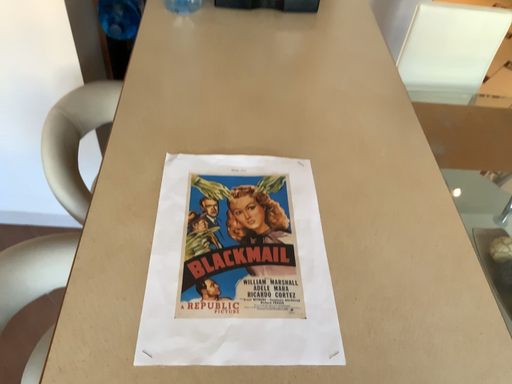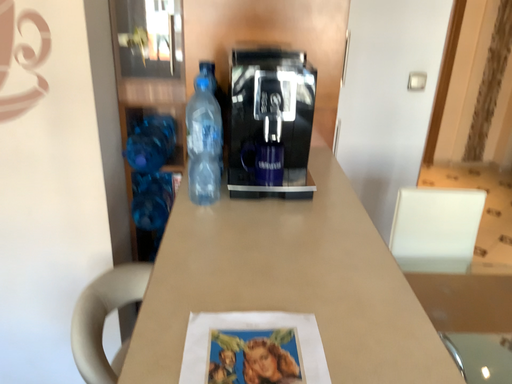
Question: Which way did the camera rotate in the video?

Choices:
 (A) rotated downward
 (B) rotated upward

Answer: (B)